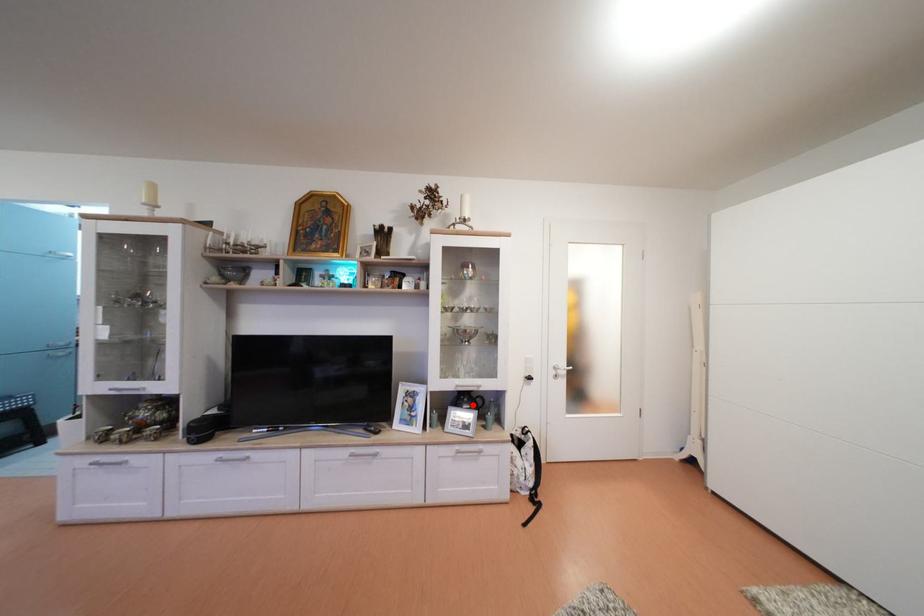
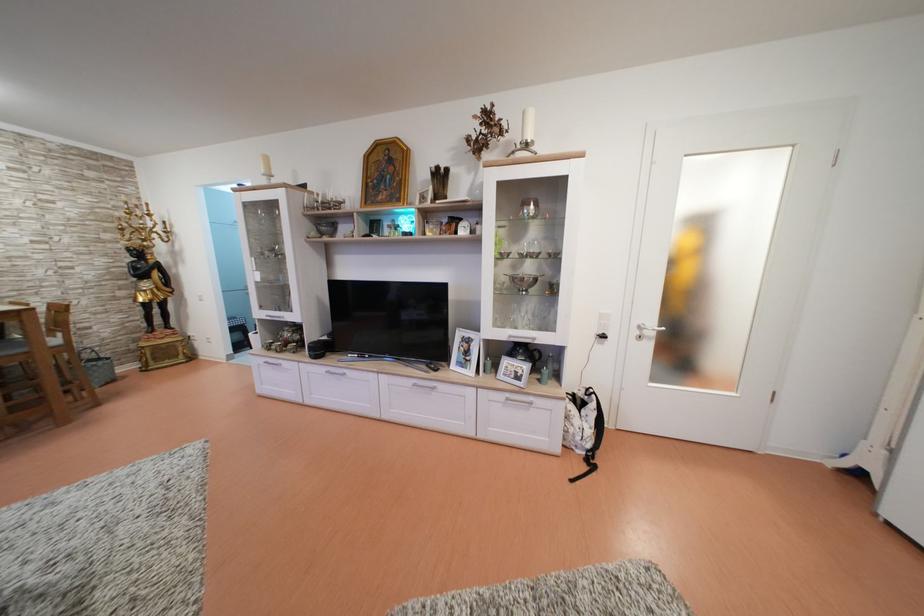
Find the pixel in the second image that matches the highlighted location in the first image.

(528, 357)